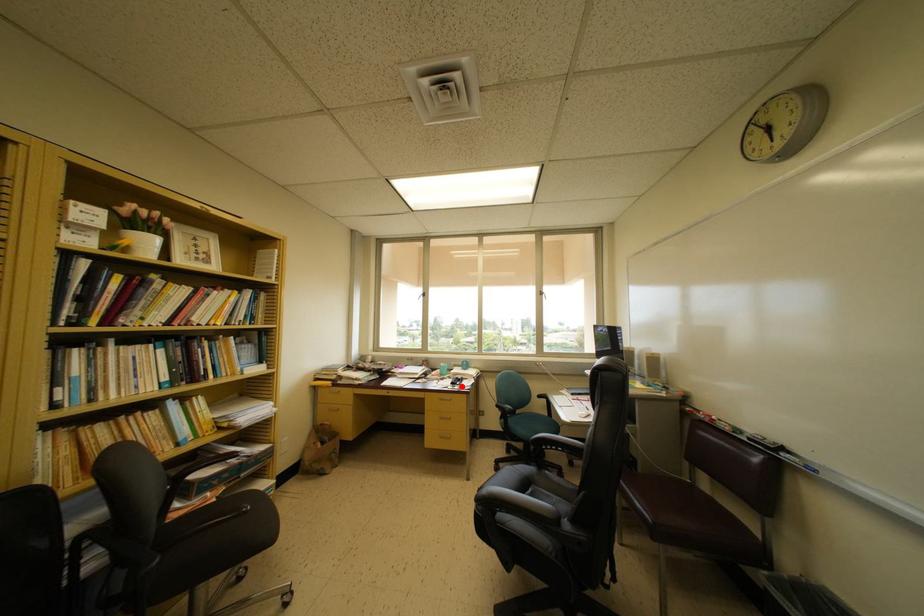
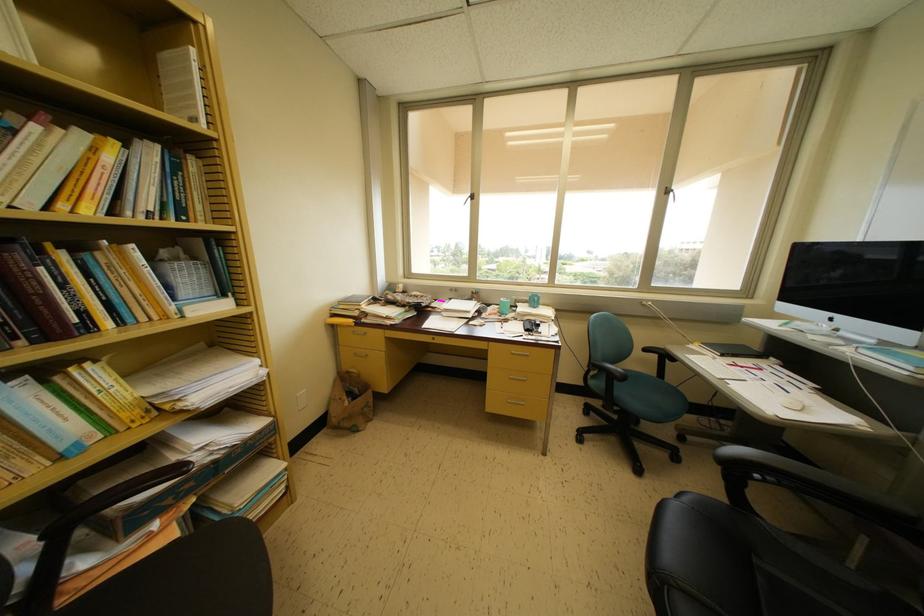
The point at the highlighted location is marked in the first image. Where is the corresponding point in the second image?

(537, 331)